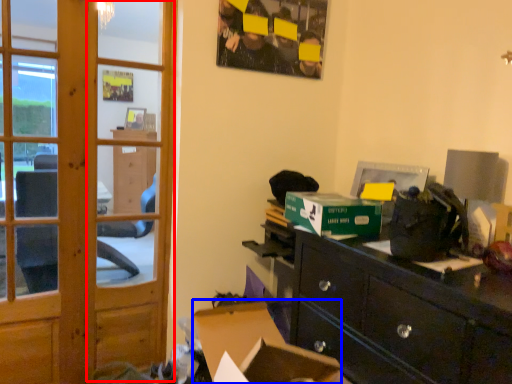
Question: Which of the following is the closest to the observer, screen door (highlighted by a red box) or computer desk (highlighted by a blue box)?

Choices:
 (A) screen door
 (B) computer desk

Answer: (B)